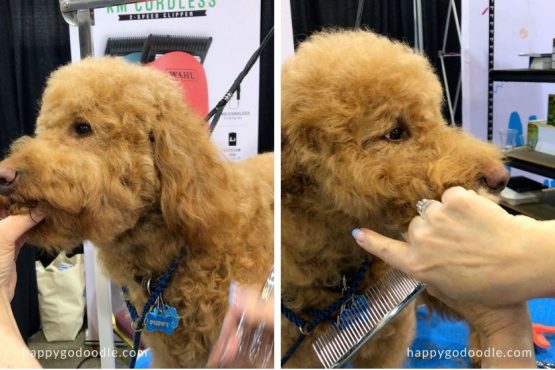
Where is `black shelf`? The height and width of the screenshot is (370, 555). black shelf is located at coordinates (516, 77).